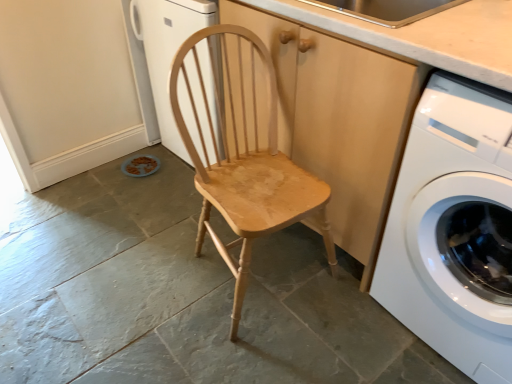
You are a GUI agent. You are given a task and a screenshot of the screen. Output one action in this format:
    pyautogui.click(x=<x>, y=<y>)
    Task: Click on the white glossy washing machine at right
    The image size is (512, 384).
    Given the screenshot: What is the action you would take?
    pyautogui.click(x=454, y=228)

What do you see at coordinates (454, 228) in the screenshot?
I see `white glossy washing machine at right` at bounding box center [454, 228].

The width and height of the screenshot is (512, 384). I want to click on light brown wood at upper center, so click(426, 36).

You are a GUI agent. You are given a task and a screenshot of the screen. Output one action in this format:
    pyautogui.click(x=<x>, y=<y>)
    Task: Click on the white glossy washing machine at right
    The width and height of the screenshot is (512, 384).
    Given the screenshot: What is the action you would take?
    pyautogui.click(x=454, y=228)

Do you think light brown wood at upper center is within wooden cabinet at center, or outside of it?

light brown wood at upper center can be found inside wooden cabinet at center.

Considering the positions of points (454, 59) and (281, 144), is point (454, 59) closer to camera compared to point (281, 144)?

Yes, it is.

Measure the distance from light brown wood at upper center to wooden cabinet at center.

The distance of light brown wood at upper center from wooden cabinet at center is 22.77 centimeters.

Does light brown wood at upper center have a lesser width compared to wooden cabinet at center?

Indeed, light brown wood at upper center has a lesser width compared to wooden cabinet at center.

Consider the image. Is wooden cabinet at center in front of natural wood chair at center?

No, the depth of wooden cabinet at center is greater than that of natural wood chair at center.

You are a GUI agent. You are given a task and a screenshot of the screen. Output one action in this format:
    pyautogui.click(x=<x>, y=<y>)
    Task: Click on the chair lying on the left of wooden cabinet at center
    This screenshot has height=384, width=512.
    Given the screenshot: What is the action you would take?
    pyautogui.click(x=244, y=160)

From a real-world perspective, relative to natural wood chair at center, is wooden cabinet at center vertically above or below?

From a real-world perspective, wooden cabinet at center is physically above natural wood chair at center.

Based on the photo, from the image's perspective, which is above, wooden cabinet at center or natural wood chair at center?

wooden cabinet at center.

What are the coordinates of `cabinetry above the white glossy washing machine at right (from the image's perspective)` in the screenshot? It's located at (337, 117).

How much distance is there between white glossy washing machine at right and wooden cabinet at center?

white glossy washing machine at right is 9.61 inches away from wooden cabinet at center.

From the image's perspective, is white glossy washing machine at right above or below wooden cabinet at center?

From the image's perspective, white glossy washing machine at right appears below wooden cabinet at center.

Between white glossy washing machine at right and wooden cabinet at center, which one appears on the left side from the viewer's perspective?

wooden cabinet at center is more to the left.

From the image's perspective, which is below, natural wood chair at center or white glossy washing machine at right?

white glossy washing machine at right, from the image's perspective.

The height and width of the screenshot is (384, 512). I want to click on chair on the left of white glossy washing machine at right, so click(x=244, y=160).

How different are the orientations of white glossy washing machine at right and light brown wood at upper center in degrees?

The angular difference between white glossy washing machine at right and light brown wood at upper center is 0.353 degrees.

From the image's perspective, who appears lower, white glossy washing machine at right or light brown wood at upper center?

white glossy washing machine at right.

Does white glossy washing machine at right have a greater width compared to light brown wood at upper center?

Yes, white glossy washing machine at right is wider than light brown wood at upper center.

Where is `counter top behind the white glossy washing machine at right`? Image resolution: width=512 pixels, height=384 pixels. counter top behind the white glossy washing machine at right is located at coordinates (426, 36).

Which is more to the left, wooden cabinet at center or white glossy washing machine at right?

wooden cabinet at center is more to the left.

From a real-world perspective, which object rests below the other?

In real-world perspective, white glossy washing machine at right is lower.

Between wooden cabinet at center and white glossy washing machine at right, which one has less height?

white glossy washing machine at right is shorter.

Is wooden cabinet at center behind white glossy washing machine at right?

Yes, wooden cabinet at center is further from the viewer.

What are the coordinates of `washing machine on the right of light brown wood at upper center` in the screenshot? It's located at (454, 228).

From a real-world perspective, between light brown wood at upper center and white glossy washing machine at right, who is vertically lower?

In real-world perspective, white glossy washing machine at right is lower.

Which of these two, light brown wood at upper center or white glossy washing machine at right, is thinner?

Thinner between the two is light brown wood at upper center.

This screenshot has height=384, width=512. I want to click on counter top that is on the left side of wooden cabinet at center, so click(426, 36).

The height and width of the screenshot is (384, 512). Find the location of `cabinetry behind the natural wood chair at center`. cabinetry behind the natural wood chair at center is located at coordinates (337, 117).

Which object lies nearer to the anchor point natural wood chair at center, wooden cabinet at center or light brown wood at upper center?

wooden cabinet at center is positioned closer to the anchor natural wood chair at center.

When comparing their distances from wooden cabinet at center, does white glossy washing machine at right or natural wood chair at center seem further?

Based on the image, white glossy washing machine at right appears to be further to wooden cabinet at center.

When comparing their distances from light brown wood at upper center, does white glossy washing machine at right or wooden cabinet at center seem closer?

The object closer to light brown wood at upper center is wooden cabinet at center.

From the image, which object appears to be farther from natural wood chair at center, light brown wood at upper center or wooden cabinet at center?

light brown wood at upper center is positioned further to the anchor natural wood chair at center.

From the picture: From the image, which object appears to be nearer to natural wood chair at center, white glossy washing machine at right or wooden cabinet at center?

Based on the image, wooden cabinet at center appears to be nearer to natural wood chair at center.

From the image, which object appears to be nearer to wooden cabinet at center, natural wood chair at center or white glossy washing machine at right?

natural wood chair at center is positioned closer to the anchor wooden cabinet at center.

Based on their spatial positions, is natural wood chair at center or white glossy washing machine at right closer to light brown wood at upper center?

The object closer to light brown wood at upper center is white glossy washing machine at right.

From the picture: Which object lies further to the anchor point light brown wood at upper center, natural wood chair at center or wooden cabinet at center?

Among the two, natural wood chair at center is located further to light brown wood at upper center.

Where is `cabinetry that lies between light brown wood at upper center and white glossy washing machine at right from top to bottom`? This screenshot has width=512, height=384. cabinetry that lies between light brown wood at upper center and white glossy washing machine at right from top to bottom is located at coordinates (337, 117).

This screenshot has height=384, width=512. Find the location of `cabinetry situated between natural wood chair at center and white glossy washing machine at right from left to right`. cabinetry situated between natural wood chair at center and white glossy washing machine at right from left to right is located at coordinates (337, 117).

Image resolution: width=512 pixels, height=384 pixels. In order to click on cabinetry that lies between light brown wood at upper center and natural wood chair at center from top to bottom in this screenshot , I will do `click(337, 117)`.

Locate an element on the screen. Image resolution: width=512 pixels, height=384 pixels. counter top between natural wood chair at center and white glossy washing machine at right from left to right is located at coordinates [x=426, y=36].